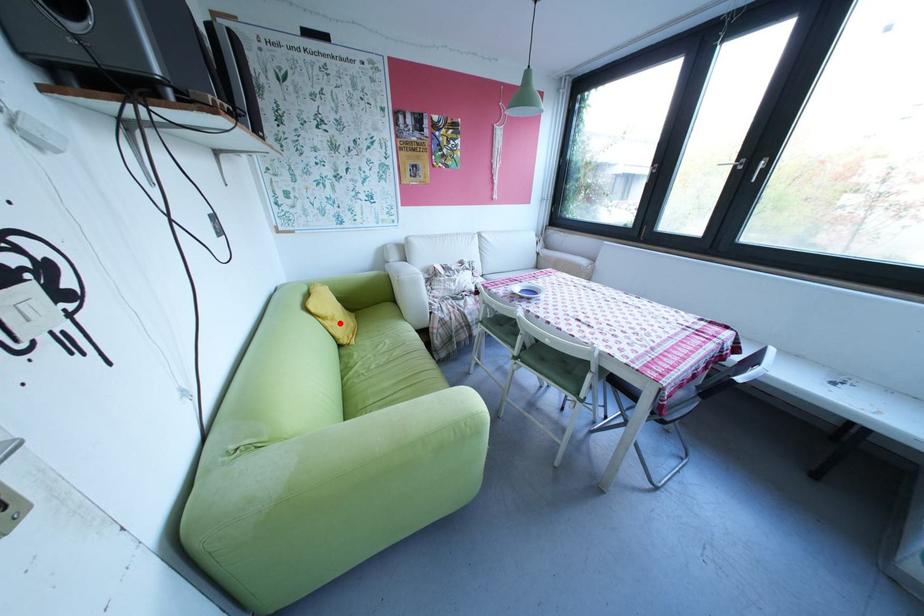
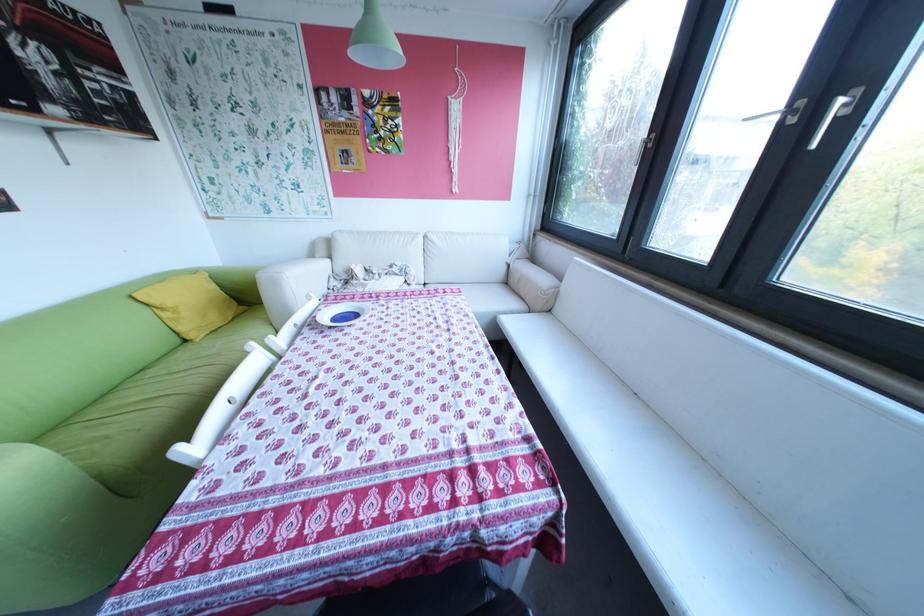
Find the pixel in the second image that matches the highlighted location in the first image.

(177, 314)